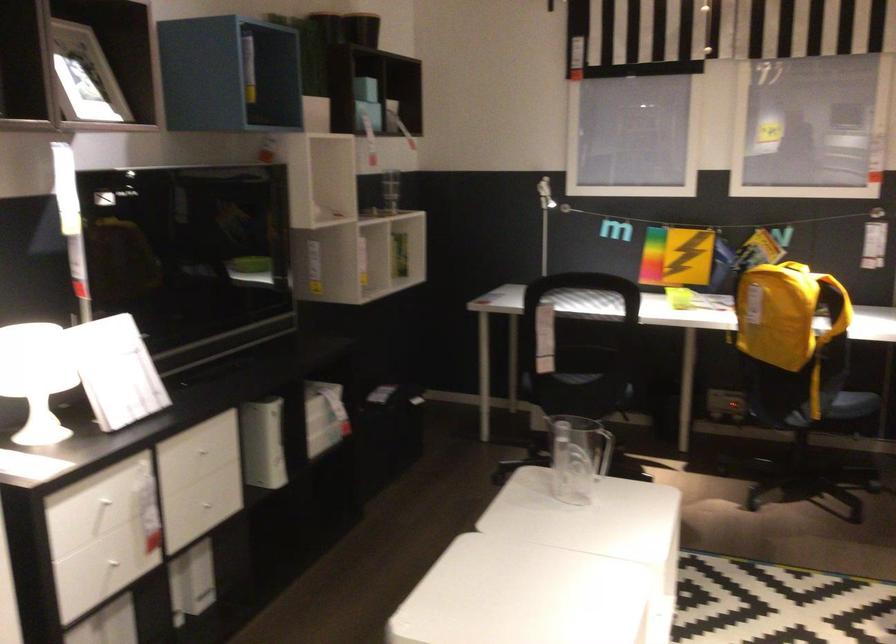
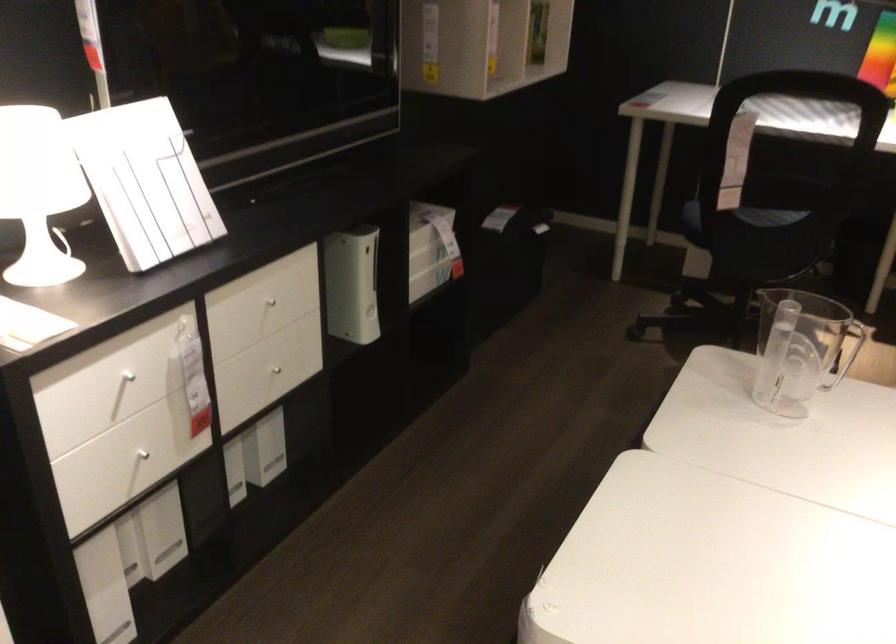
The point at (205, 451) is marked in the first image. Where is the corresponding point in the second image?

(271, 299)